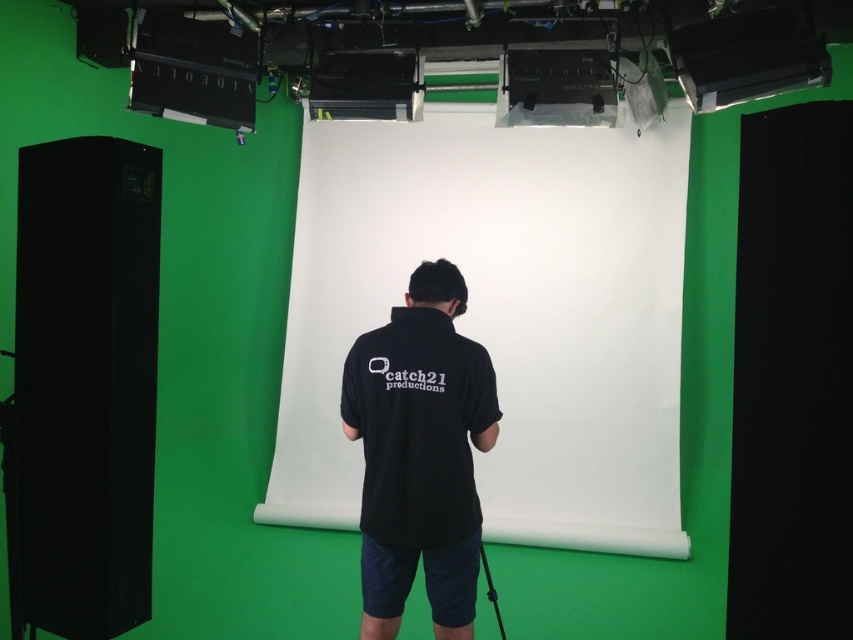
You are an assistant helping to set up the studio. You need to determine if the white matte projection screen at center can be placed above the black cotton shirt at center without overlapping. Based on their heights, can this arrangement be achieved?

The white matte projection screen at center is much taller than the black cotton shirt at center, so it can be placed above without overlapping as long as there is sufficient vertical space.

You are standing in a studio and need to position a light source directly in front of the white matte projection screen at center. According to the studio layout, where should you place the light source relative to the screen?

The white matte projection screen at center is located at point [502,314], so you should place the light source directly in front of this coordinate to illuminate it properly.